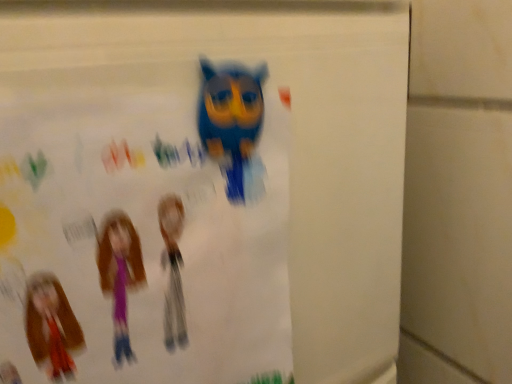
Question: Should I look upward or downward to see matte paper poster at upper center?

Choices:
 (A) up
 (B) down

Answer: (B)

Question: Is blue matte owl at upper center taller than matte paper poster at upper center?

Choices:
 (A) yes
 (B) no

Answer: (B)

Question: Considering the relative sizes of blue matte owl at upper center and matte paper poster at upper center in the image provided, is blue matte owl at upper center shorter than matte paper poster at upper center?

Choices:
 (A) no
 (B) yes

Answer: (B)

Question: Is matte paper poster at upper center completely or partially inside blue matte owl at upper center?

Choices:
 (A) yes
 (B) no

Answer: (B)

Question: Is blue matte owl at upper center far away from matte paper poster at upper center?

Choices:
 (A) no
 (B) yes

Answer: (A)

Question: Can you confirm if blue matte owl at upper center is thinner than matte paper poster at upper center?

Choices:
 (A) yes
 (B) no

Answer: (A)

Question: Is blue matte owl at upper center closer to the viewer compared to matte paper poster at upper center?

Choices:
 (A) no
 (B) yes

Answer: (A)

Question: Considering the relative sizes of matte paper poster at upper center and blue matte owl at upper center in the image provided, is matte paper poster at upper center taller than blue matte owl at upper center?

Choices:
 (A) no
 (B) yes

Answer: (B)

Question: Can you confirm if matte paper poster at upper center is wider than blue matte owl at upper center?

Choices:
 (A) no
 (B) yes

Answer: (B)

Question: Could blue matte owl at upper center be considered to be inside matte paper poster at upper center?

Choices:
 (A) yes
 (B) no

Answer: (A)

Question: Is matte paper poster at upper center outside of blue matte owl at upper center?

Choices:
 (A) yes
 (B) no

Answer: (A)

Question: Are matte paper poster at upper center and blue matte owl at upper center making contact?

Choices:
 (A) no
 (B) yes

Answer: (B)

Question: Is matte paper poster at upper center aimed at blue matte owl at upper center?

Choices:
 (A) no
 (B) yes

Answer: (B)

Question: Considering the positions of blue matte owl at upper center and matte paper poster at upper center in the image, is blue matte owl at upper center bigger or smaller than matte paper poster at upper center?

Choices:
 (A) big
 (B) small

Answer: (B)